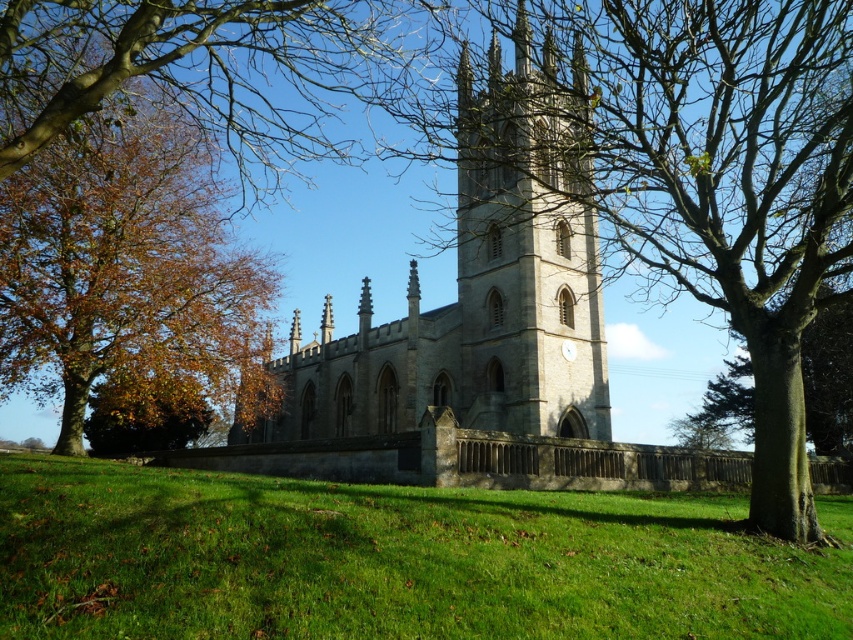
You are a landscape architect planning to install a new pathway between the bare wood tree at center and the autumn leaves at left. The pathway must be at least 60 meters long to accommodate a walking trail. Can the proposed pathway fit between them based on their current distance?

The distance between the bare wood tree at center and the autumn leaves at left is 64.37 meters, which exceeds the required 60 meters. Therefore, the pathway can be installed as planned.